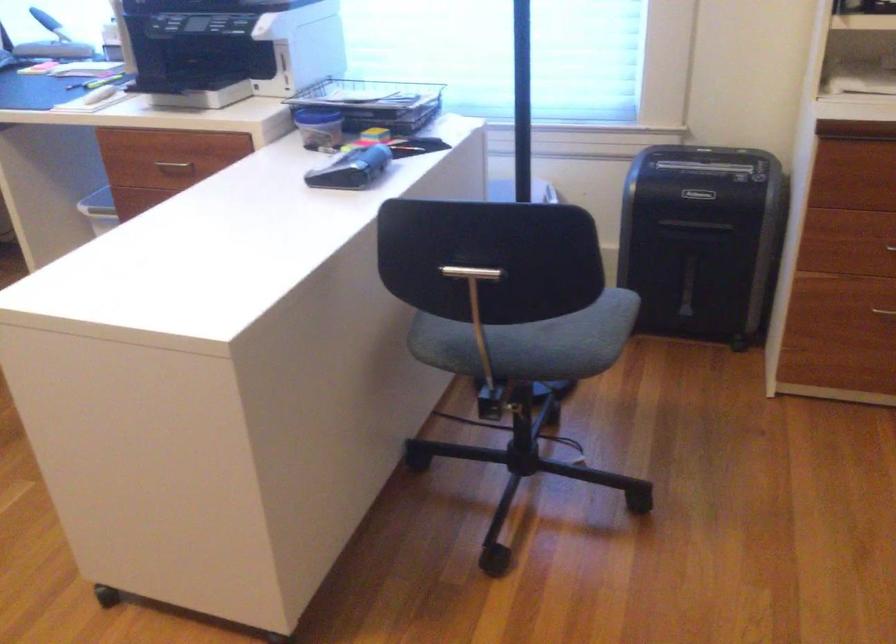
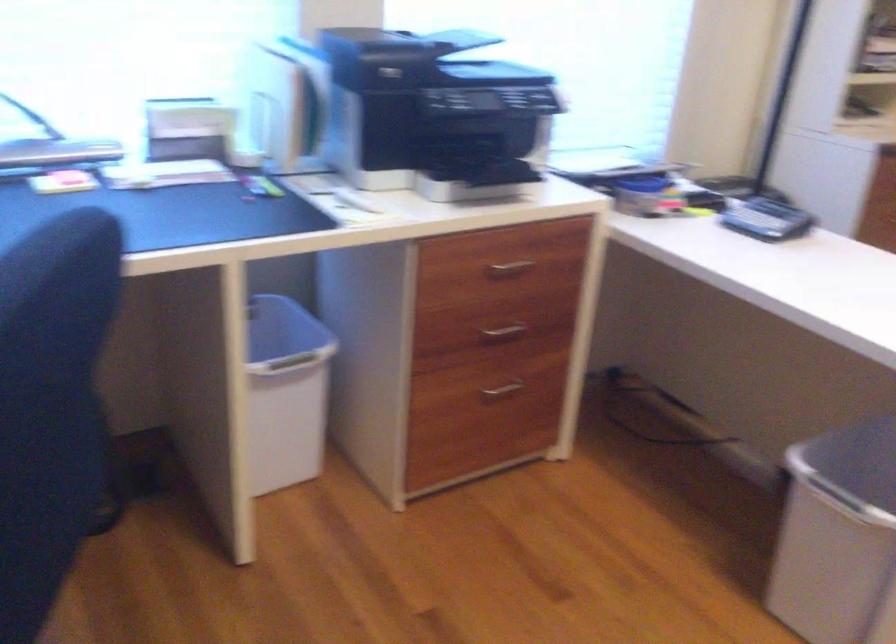
In the second image, find the point that corresponds to pixel 185 165 in the first image.

(510, 268)